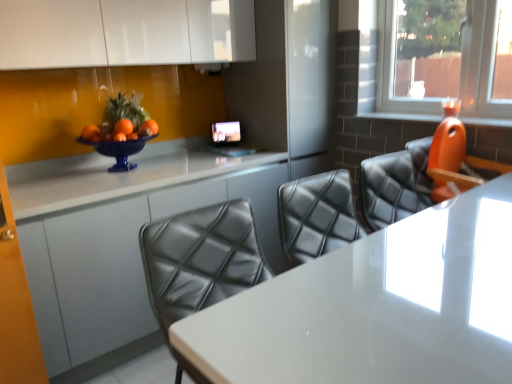
Question: Is white glossy table at center far away from transparent glass candle at upper right?

Choices:
 (A) yes
 (B) no

Answer: (A)

Question: Is white glossy table at center to the left of transparent glass candle at upper right from the viewer's perspective?

Choices:
 (A) no
 (B) yes

Answer: (B)

Question: Is white glossy table at center thinner than transparent glass candle at upper right?

Choices:
 (A) no
 (B) yes

Answer: (A)

Question: Considering the relative sizes of white glossy table at center and transparent glass candle at upper right in the image provided, is white glossy table at center shorter than transparent glass candle at upper right?

Choices:
 (A) yes
 (B) no

Answer: (B)

Question: Considering the relative sizes of white glossy table at center and transparent glass candle at upper right in the image provided, is white glossy table at center wider than transparent glass candle at upper right?

Choices:
 (A) no
 (B) yes

Answer: (B)

Question: In the image, is white glossy counter at center on the left side or the right side of white glossy table at center?

Choices:
 (A) right
 (B) left

Answer: (B)

Question: Considering the positions of white glossy counter at center and white glossy table at center in the image, is white glossy counter at center wider or thinner than white glossy table at center?

Choices:
 (A) thin
 (B) wide

Answer: (B)

Question: Is white glossy counter at center spatially inside white glossy table at center, or outside of it?

Choices:
 (A) inside
 (B) outside

Answer: (B)

Question: Looking at the image, does white glossy counter at center seem bigger or smaller compared to white glossy table at center?

Choices:
 (A) small
 (B) big

Answer: (A)

Question: In terms of height, does transparent glass candle at upper right look taller or shorter compared to orange plastic chair at right?

Choices:
 (A) short
 (B) tall

Answer: (B)

Question: From a real-world perspective, is transparent glass candle at upper right positioned above or below orange plastic chair at right?

Choices:
 (A) below
 (B) above

Answer: (B)

Question: In terms of width, does transparent glass candle at upper right look wider or thinner when compared to orange plastic chair at right?

Choices:
 (A) wide
 (B) thin

Answer: (B)

Question: From the image's perspective, relative to orange plastic chair at right, is transparent glass candle at upper right above or below?

Choices:
 (A) below
 (B) above

Answer: (B)

Question: Is white glossy table at center to the left or to the right of orange plastic chair at right in the image?

Choices:
 (A) right
 (B) left

Answer: (B)

Question: From the image's perspective, relative to orange plastic chair at right, is white glossy table at center above or below?

Choices:
 (A) above
 (B) below

Answer: (B)